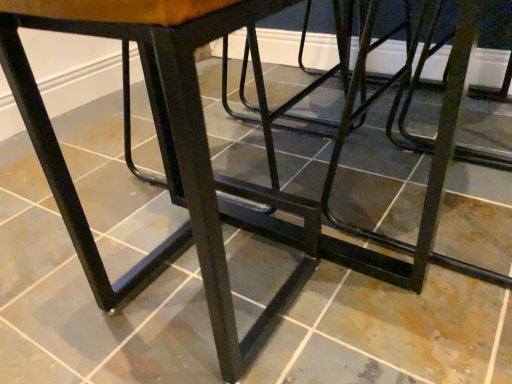
Find the location of a particular element. The height and width of the screenshot is (384, 512). matte black stool at center is located at coordinates (168, 157).

The image size is (512, 384). Describe the element at coordinates (168, 157) in the screenshot. I see `matte black stool at center` at that location.

The image size is (512, 384). What are the coordinates of `matte black stool at center` in the screenshot? It's located at (168, 157).